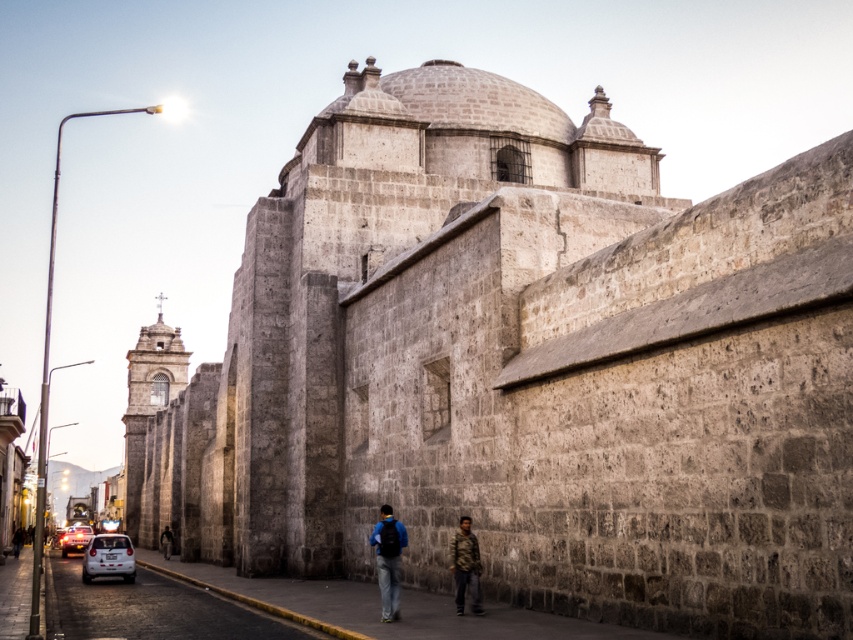
Can you confirm if blue fabric backpack at center is positioned above white matte car at lower left?

Yes, blue fabric backpack at center is above white matte car at lower left.

The width and height of the screenshot is (853, 640). What do you see at coordinates (387, 561) in the screenshot?
I see `blue fabric backpack at center` at bounding box center [387, 561].

The width and height of the screenshot is (853, 640). What do you see at coordinates (387, 561) in the screenshot? I see `blue fabric backpack at center` at bounding box center [387, 561].

Find the location of a particular element. Image resolution: width=853 pixels, height=640 pixels. blue fabric backpack at center is located at coordinates (387, 561).

Is point (460, 611) positioned behind point (111, 564)?

No, it is not.

Is camouflage jacket at lower right below white matte car at lower left?

No, camouflage jacket at lower right is not below white matte car at lower left.

In order to click on camouflage jacket at lower right in this screenshot , I will do `click(465, 564)`.

Who is taller, blue fabric backpack at center or camouflage jacket at lower right?

blue fabric backpack at center is taller.

This screenshot has width=853, height=640. I want to click on blue fabric backpack at center, so click(387, 561).